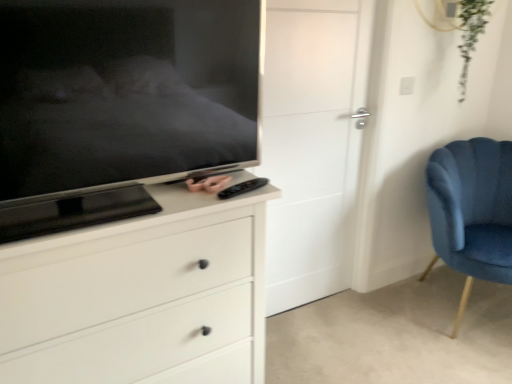
Question: Would you say pink matte remote control at center is outside matte black tv at left?

Choices:
 (A) yes
 (B) no

Answer: (B)

Question: Does pink matte remote control at center have a greater height compared to matte black tv at left?

Choices:
 (A) yes
 (B) no

Answer: (B)

Question: Is pink matte remote control at center not close to matte black tv at left?

Choices:
 (A) no
 (B) yes

Answer: (A)

Question: Can you confirm if pink matte remote control at center is wider than matte black tv at left?

Choices:
 (A) yes
 (B) no

Answer: (B)

Question: Does pink matte remote control at center appear on the left side of matte black tv at left?

Choices:
 (A) no
 (B) yes

Answer: (A)

Question: Is the depth of pink matte remote control at center less than that of matte black tv at left?

Choices:
 (A) no
 (B) yes

Answer: (A)

Question: From a real-world perspective, is white matte chest of drawers at center located beneath white matte door at center?

Choices:
 (A) no
 (B) yes

Answer: (B)

Question: Is white matte chest of drawers at center to the right of white matte door at center from the viewer's perspective?

Choices:
 (A) no
 (B) yes

Answer: (A)

Question: Can you confirm if white matte chest of drawers at center is taller than white matte door at center?

Choices:
 (A) yes
 (B) no

Answer: (B)

Question: Are white matte chest of drawers at center and white matte door at center beside each other?

Choices:
 (A) no
 (B) yes

Answer: (A)

Question: Is white matte chest of drawers at center completely or partially outside of white matte door at center?

Choices:
 (A) yes
 (B) no

Answer: (A)

Question: Is white matte chest of drawers at center not close to white matte door at center?

Choices:
 (A) yes
 (B) no

Answer: (B)

Question: Is white matte chest of drawers at center at the right side of velvet blue chair at right?

Choices:
 (A) no
 (B) yes

Answer: (A)